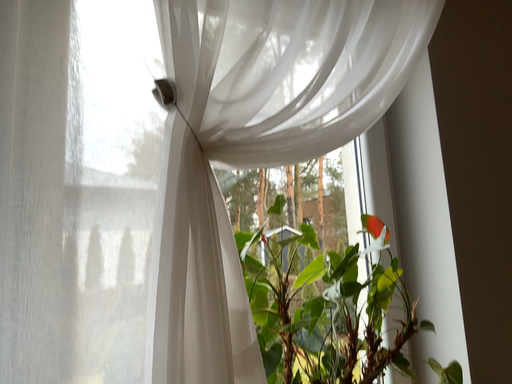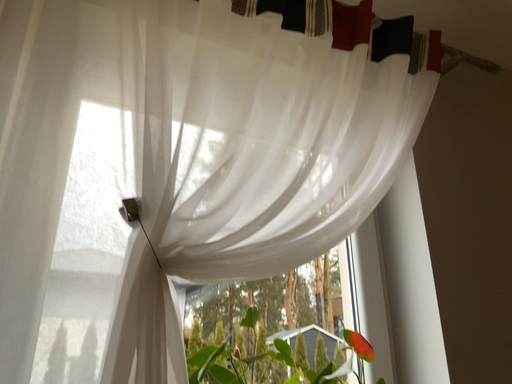
Question: How did the camera likely rotate when shooting the video?

Choices:
 (A) rotated upward
 (B) rotated downward

Answer: (A)